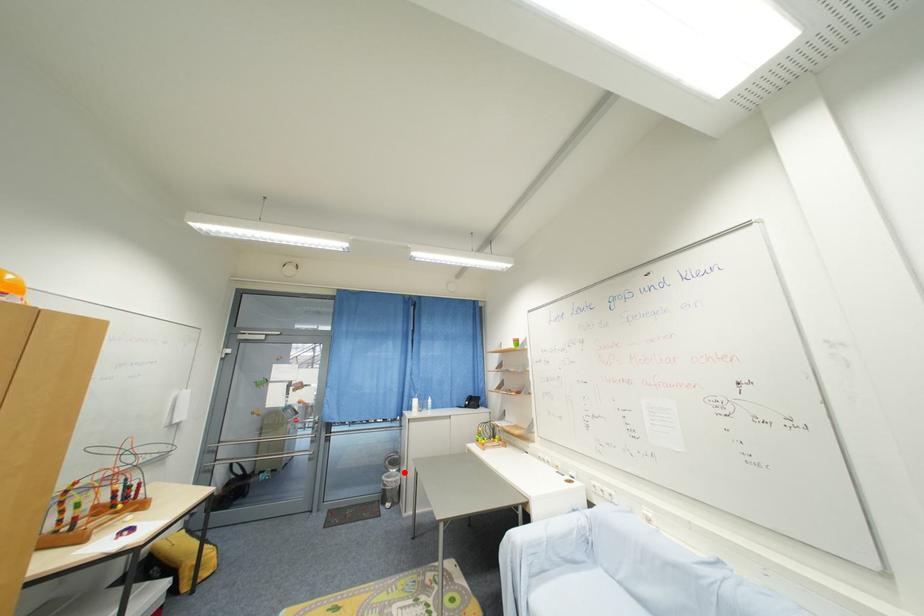
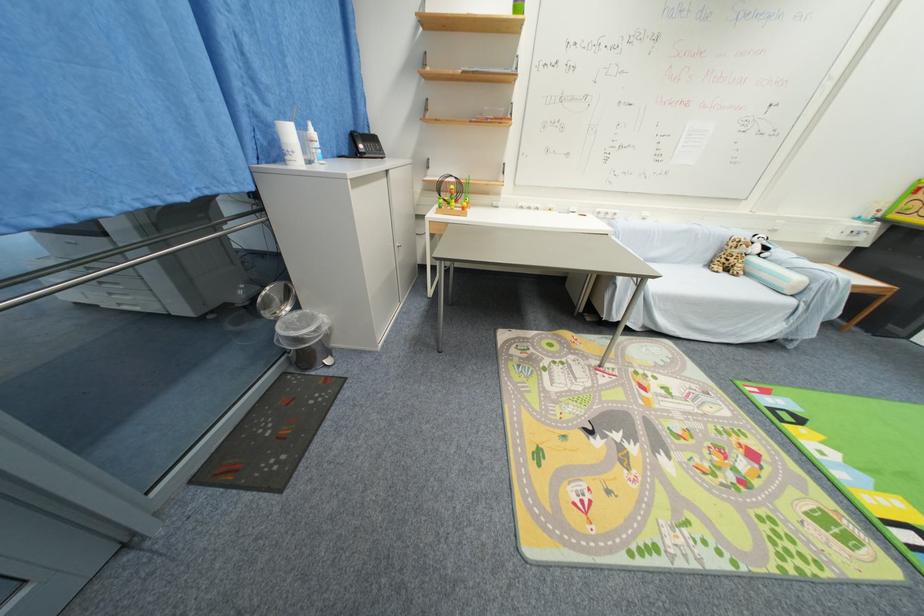
Question: I am providing you with two images of the same scene from different viewpoints. In image1, a red point is highlighted. Considering the same 3D point in image2, which of the following is correct?

Choices:
 (A) It is closer
 (B) It is farther

Answer: (A)